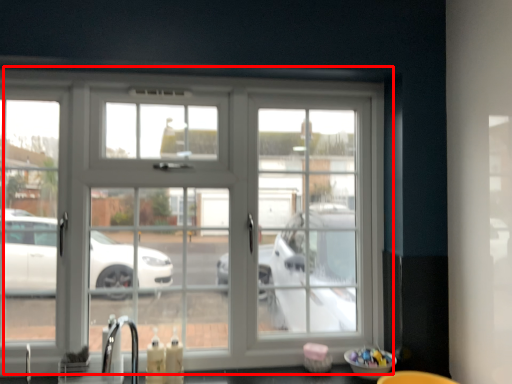
Question: From the image's perspective, considering the relative positions of window (annotated by the red box) and faucet in the image provided, where is window (annotated by the red box) located with respect to the staircase?

Choices:
 (A) below
 (B) above

Answer: (B)